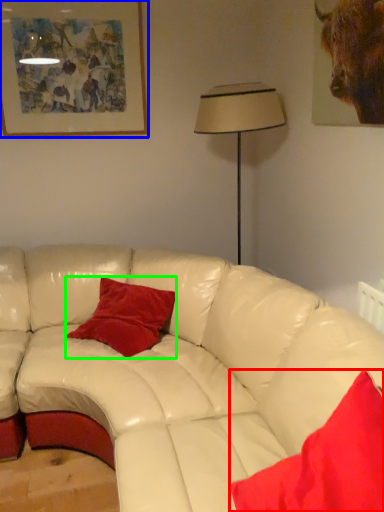
Question: Considering the real-world distances, which object is closest to pillow (highlighted by a red box)? picture frame (highlighted by a blue box) or pillow (highlighted by a green box).

Choices:
 (A) picture frame
 (B) pillow

Answer: (B)